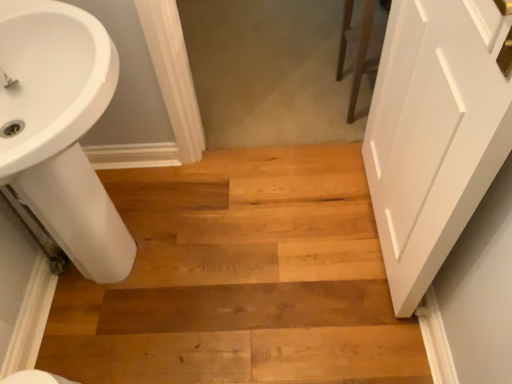
Locate an element on the screen. Image resolution: width=512 pixels, height=384 pixels. vacant space situated above natural wood floor at center (from a real-world perspective) is located at coordinates point(236,249).